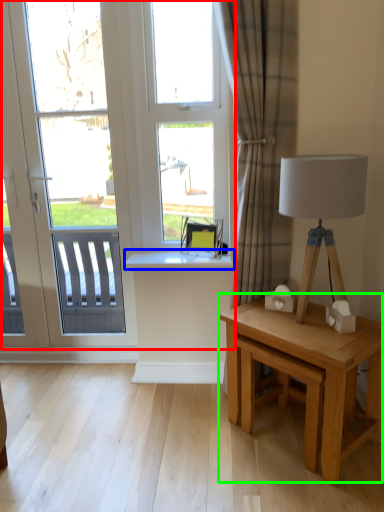
Question: Which is nearer to the window (highlighted by a red box)? window sill (highlighted by a blue box) or table (highlighted by a green box).

Choices:
 (A) window sill
 (B) table

Answer: (A)